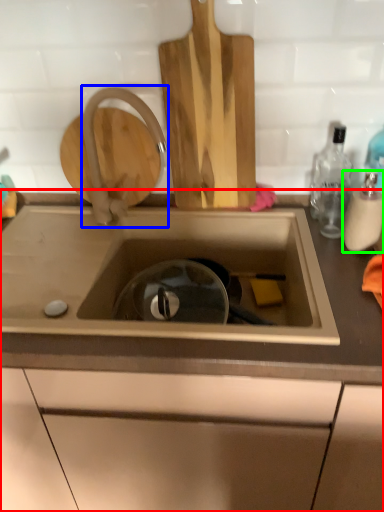
Question: Which object is positioned farthest from countertop (highlighted by a red box)? Select from tap (highlighted by a blue box) and bottle (highlighted by a green box).

Choices:
 (A) tap
 (B) bottle

Answer: (B)